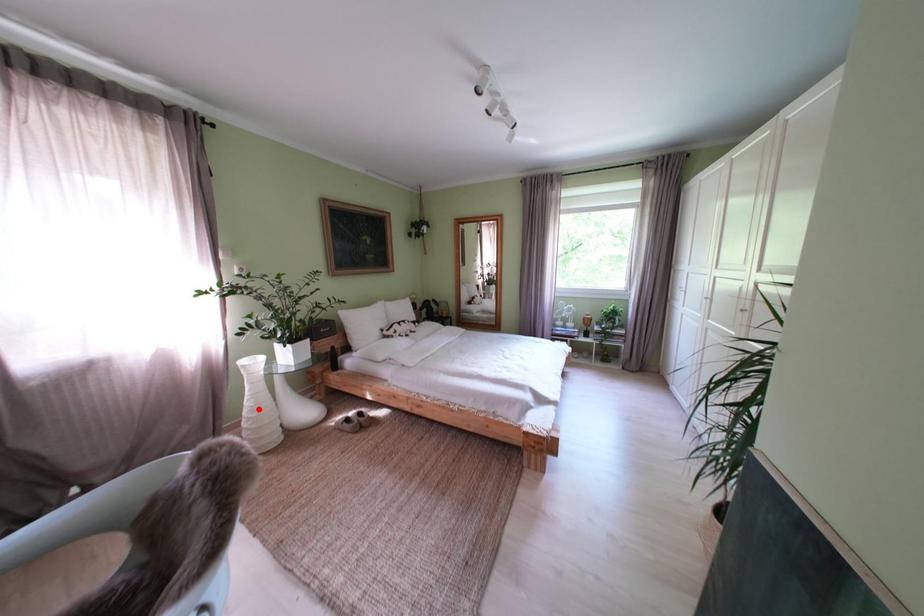
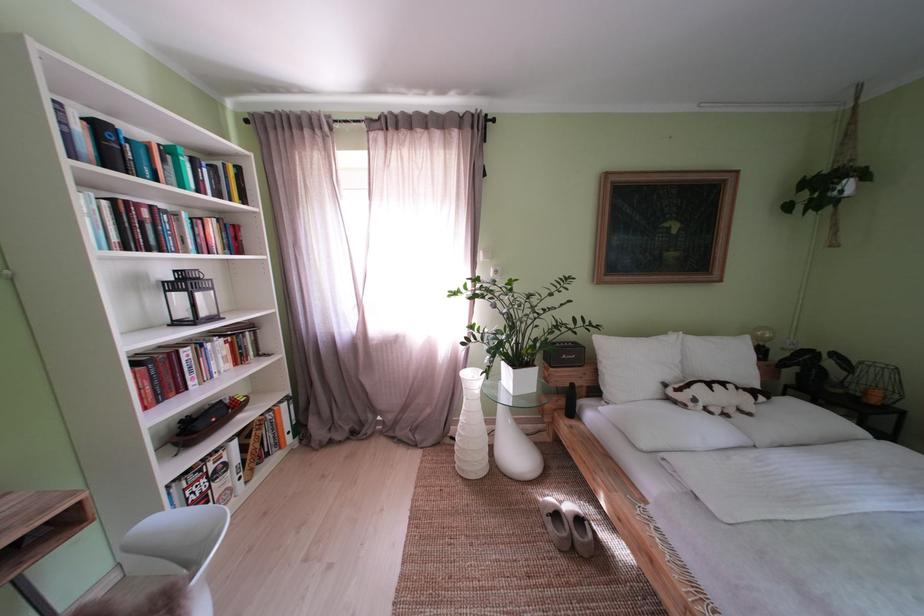
Locate, in the second image, the point that corresponds to the highlighted location in the first image.

(472, 424)